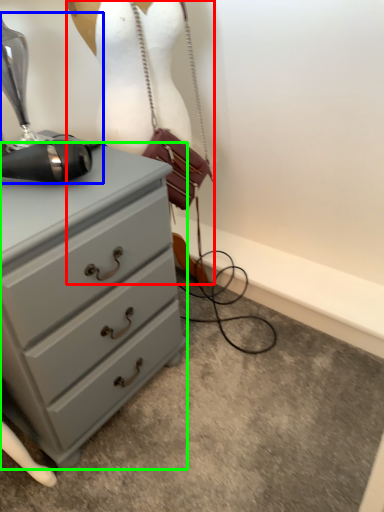
Question: Estimate the real-world distances between objects in this image. Which object is farther from mannequin (highlighted by a red box), sewing machine (highlighted by a blue box) or chest of drawers (highlighted by a green box)?

Choices:
 (A) sewing machine
 (B) chest of drawers

Answer: (B)